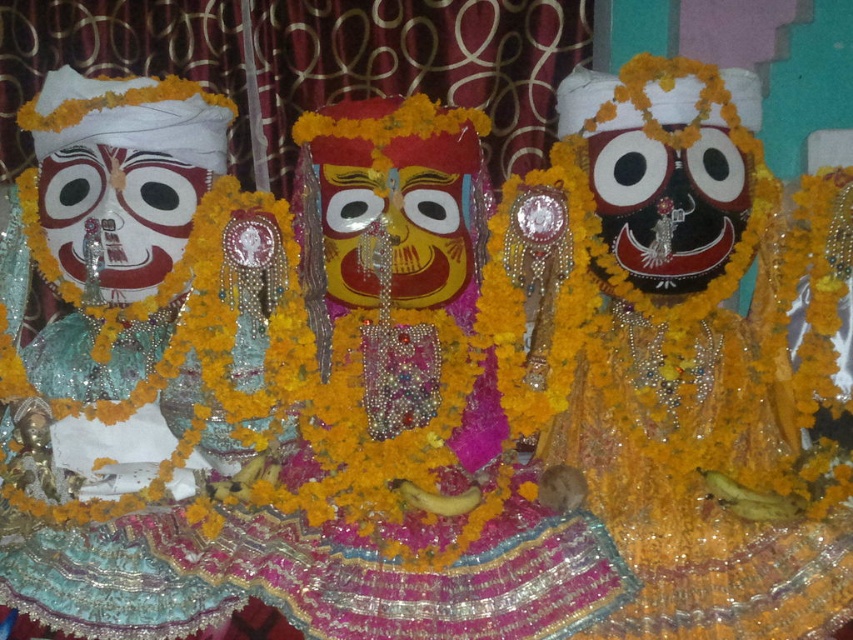
Question: Can you confirm if matte black mask at center is wider than yellow matte mask at center?

Choices:
 (A) yes
 (B) no

Answer: (A)

Question: Considering the relative positions of shiny gold ornament at center and matte green statue at left in the image provided, where is shiny gold ornament at center located with respect to matte green statue at left?

Choices:
 (A) right
 (B) left

Answer: (A)

Question: Considering the real-world distances, which object is farthest from the matte white mask at left?

Choices:
 (A) matte green statue at left
 (B) shiny gold ornament at center
 (C) yellow matte mask at center
 (D) matte black mask at center

Answer: (B)

Question: Which of the following is the closest to the observer?

Choices:
 (A) matte black mask at center
 (B) yellow matte mask at center
 (C) matte green statue at left
 (D) matte white mask at left

Answer: (C)

Question: Which point appears farthest from the camera in this image?

Choices:
 (A) (686, 534)
 (B) (637, 205)
 (C) (163, 422)

Answer: (C)

Question: Is matte green statue at left positioned in front of yellow matte mask at center?

Choices:
 (A) no
 (B) yes

Answer: (B)